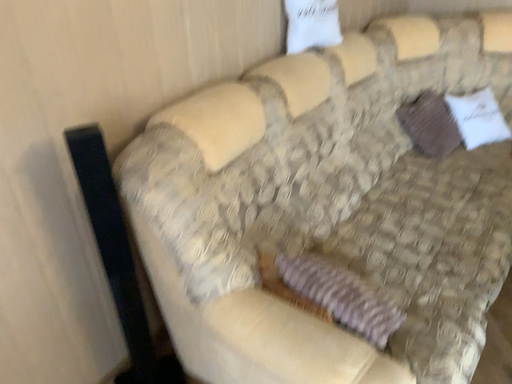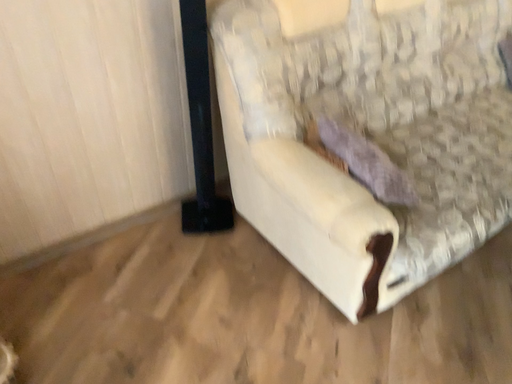
Question: Which way did the camera rotate in the video?

Choices:
 (A) rotated upward
 (B) rotated downward

Answer: (B)